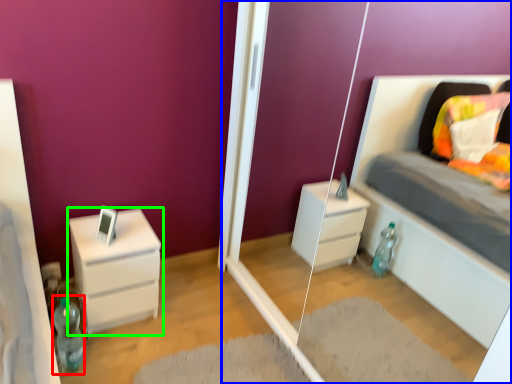
Question: Which object is the closest to the bottle (highlighted by a red box)? Choose among these: glass door (highlighted by a blue box) or chest of drawers (highlighted by a green box).

Choices:
 (A) glass door
 (B) chest of drawers

Answer: (B)